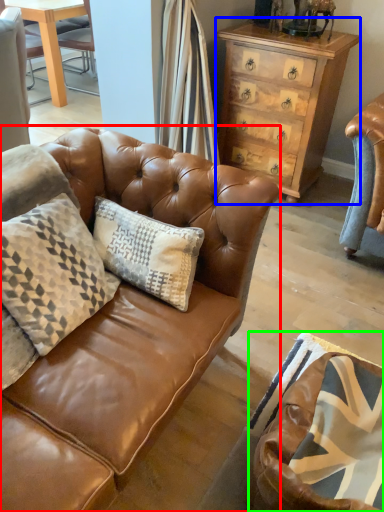
Question: Based on their relative distances, which object is farther from studio couch (highlighted by a red box)? Choose from chest of drawers (highlighted by a blue box) and swivel chair (highlighted by a green box).

Choices:
 (A) chest of drawers
 (B) swivel chair

Answer: (A)